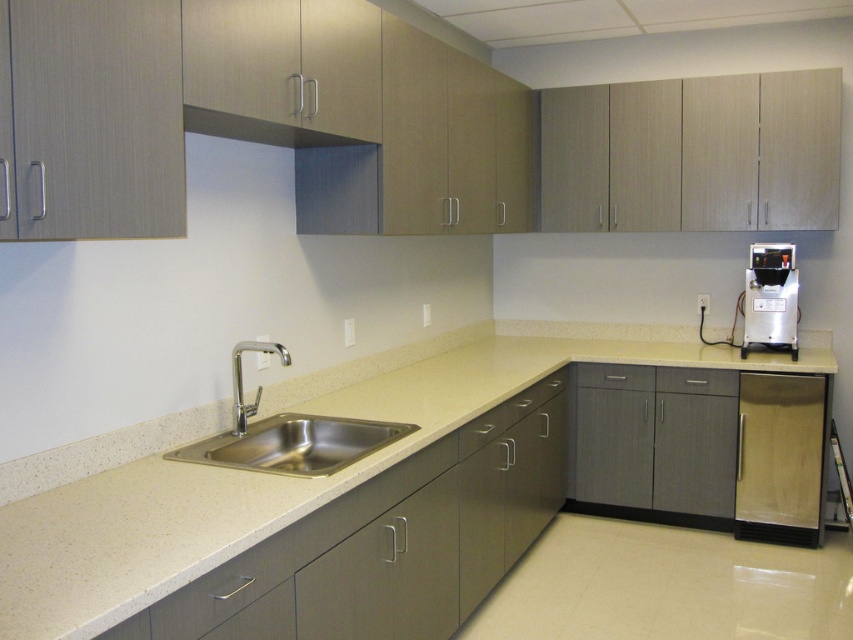
You are standing in the kitchenette and want to place a small plant between the two points marked as point (193, 458) and point (553, 374). Which point should the plant be closer to in order to be in front of both?

The plant should be closer to point (193, 458) because it is in front of point (553, 374).

In the scene shown: You are standing in the kitchenette and want to place a small bowl on the beige laminate countertop at center. However, there is a polished chrome faucet at upper left nearby. Which object is closer to you where you can easily reach it?

The beige laminate countertop at center is closer to the viewer than the polished chrome faucet at upper left, so you can easily reach it.